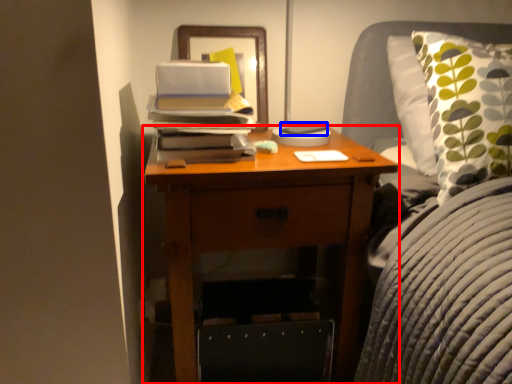
Question: Which point is closer to the camera, nightstand (highlighted by a red box) or paperback book (highlighted by a blue box)?

Choices:
 (A) nightstand
 (B) paperback book

Answer: (A)